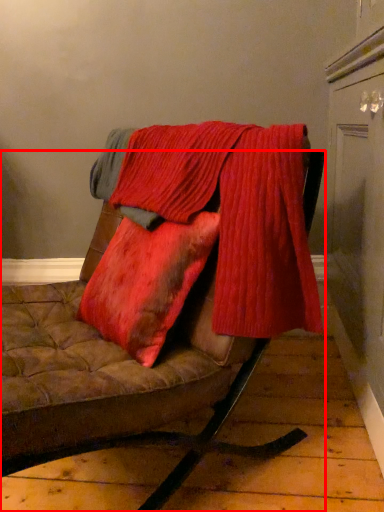
Question: In this image, where is furniture (annotated by the red box) located relative to laundry?

Choices:
 (A) right
 (B) left

Answer: (B)